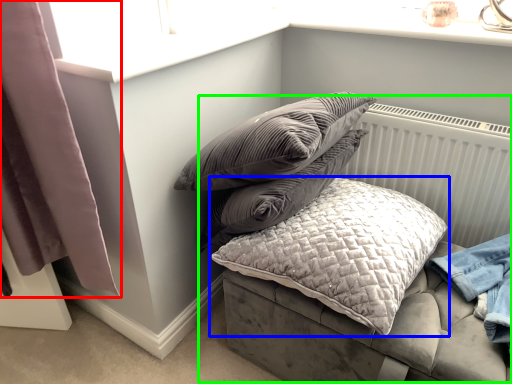
Question: Estimate the real-world distances between objects in this image. Which object is closer to curtain (highlighted by a red box), pillow (highlighted by a blue box) or bed (highlighted by a green box)?

Choices:
 (A) pillow
 (B) bed

Answer: (A)